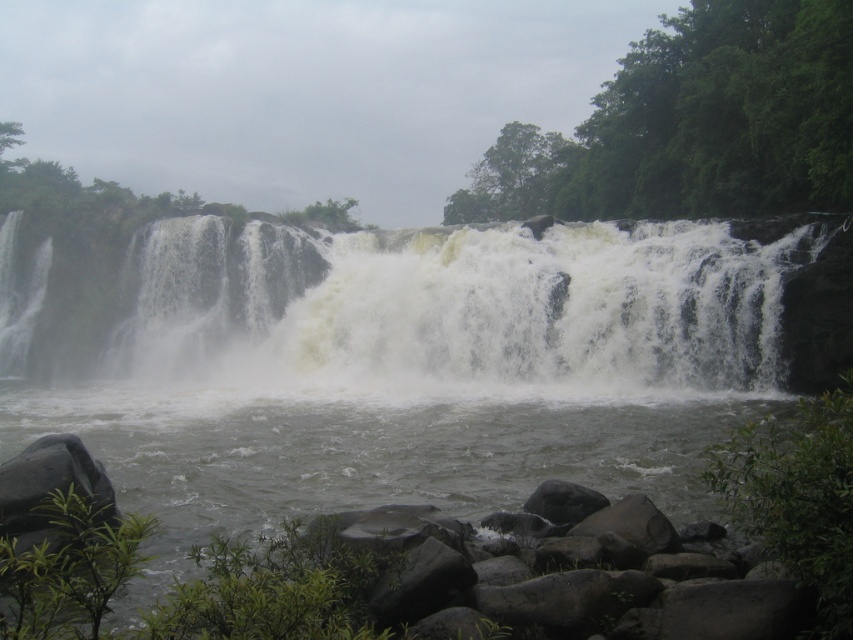
Does gray rough rock at lower center have a lesser width compared to gray rock river at center?

Indeed, gray rough rock at lower center has a lesser width compared to gray rock river at center.

Does point (495, 556) come behind point (578, 621)?

Yes, point (495, 556) is farther from viewer.

This screenshot has height=640, width=853. In order to click on gray rough rock at lower center in this screenshot , I will do `click(567, 577)`.

What are the coordinates of `gray rough rock at lower center` in the screenshot? It's located at (567, 577).

Between point (628, 502) and point (582, 493), which one is positioned behind?

Point (582, 493)

Can you confirm if gray rock river at center is taller than smooth gray rock at lower center?

Yes, gray rock river at center is taller than smooth gray rock at lower center.

Image resolution: width=853 pixels, height=640 pixels. Describe the element at coordinates (796, 490) in the screenshot. I see `gray rock river at center` at that location.

At what (x,y) coordinates should I click in order to perform the action: click on gray rock river at center. Please return your answer as a coordinate pair (x, y). The image size is (853, 640). Looking at the image, I should click on (796, 490).

Is gray rough rock at lower center shorter than smooth gray rock at lower center?

No.

Who is more forward, (589, 556) or (552, 502)?

Point (589, 556)

The image size is (853, 640). What do you see at coordinates (567, 577) in the screenshot?
I see `gray rough rock at lower center` at bounding box center [567, 577].

Image resolution: width=853 pixels, height=640 pixels. What are the coordinates of `gray rough rock at lower center` in the screenshot? It's located at (567, 577).